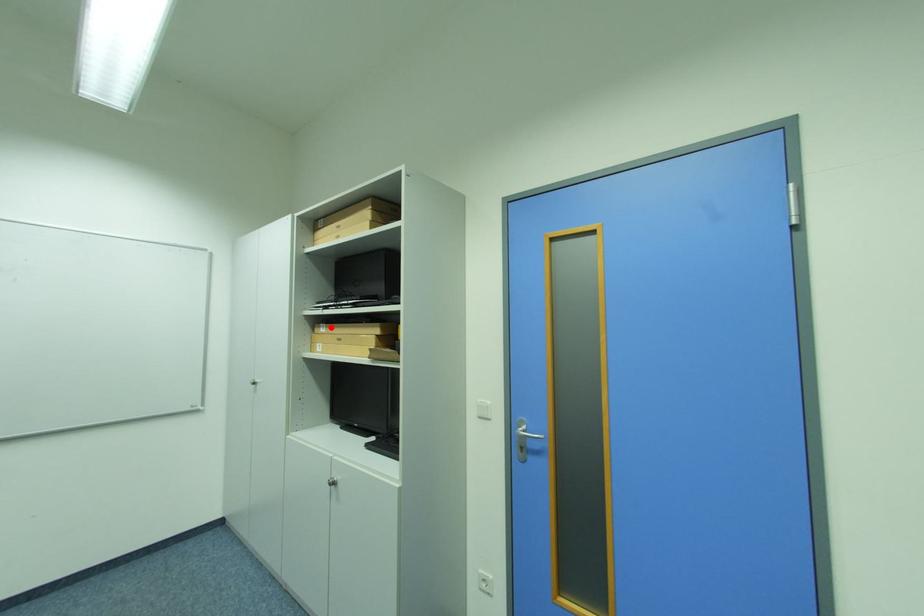
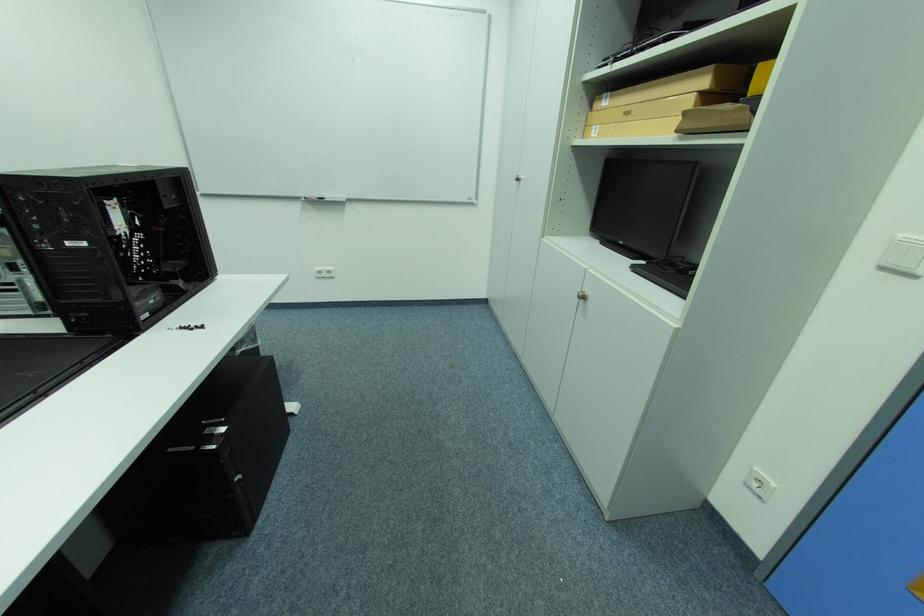
Question: I am providing you with two images of the same scene from different viewpoints. A red point is marked on the first image. Can you still see the location of the red point in image 2?

Choices:
 (A) Yes
 (B) No

Answer: (A)